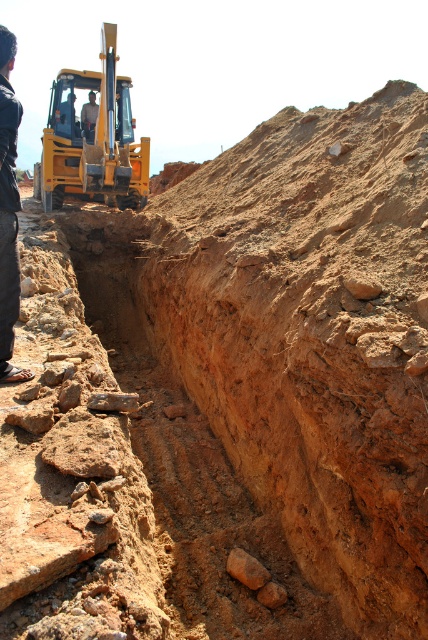
You are a safety inspector at the construction site. You notice the dark blue shirt at left and the brown rough rock at center. Which object is wider from your perspective?

The brown rough rock at center is wider than the dark blue shirt at left.

You are a safety inspector at the construction site. You notice two points marked on the trench wall. The first point is at coordinate point (8, 93) and the second point is at coordinate point (253, 572). Which point is closer to you as you stand at the edge of the trench?

Point (8, 93) is closer to the camera than point (253, 572), so the first point is closer to you as you stand at the edge of the trench.

You are a safety inspector at the construction site. You notice the yellow metallic excavator at upper left and the brown rough rock at center. According to safety protocols, heavy machinery must be kept at least 2 meters away from any unstable ground. Can you determine if the excavator is positioned safely?

The yellow metallic excavator at upper left is positioned over the brown rough rock at center. Since the excavator is over the unstable ground, it violates the safety protocol requiring a minimum distance of 2 meters. The excavator should be moved to a stable area.